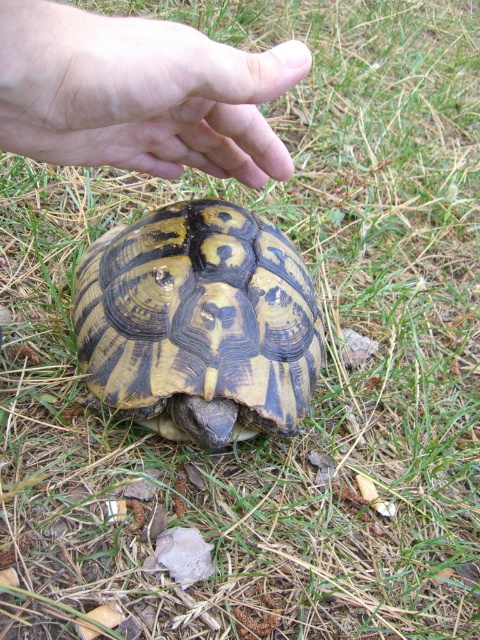
This screenshot has height=640, width=480. Describe the element at coordinates (199, 323) in the screenshot. I see `patterned shell tortoise at center` at that location.

From the picture: Which is more to the right, patterned shell tortoise at center or smooth skin hand at upper center?

smooth skin hand at upper center

Does point (87, 369) come behind point (116, 166)?

That is True.

Locate an element on the screen. Image resolution: width=480 pixels, height=640 pixels. patterned shell tortoise at center is located at coordinates (199, 323).